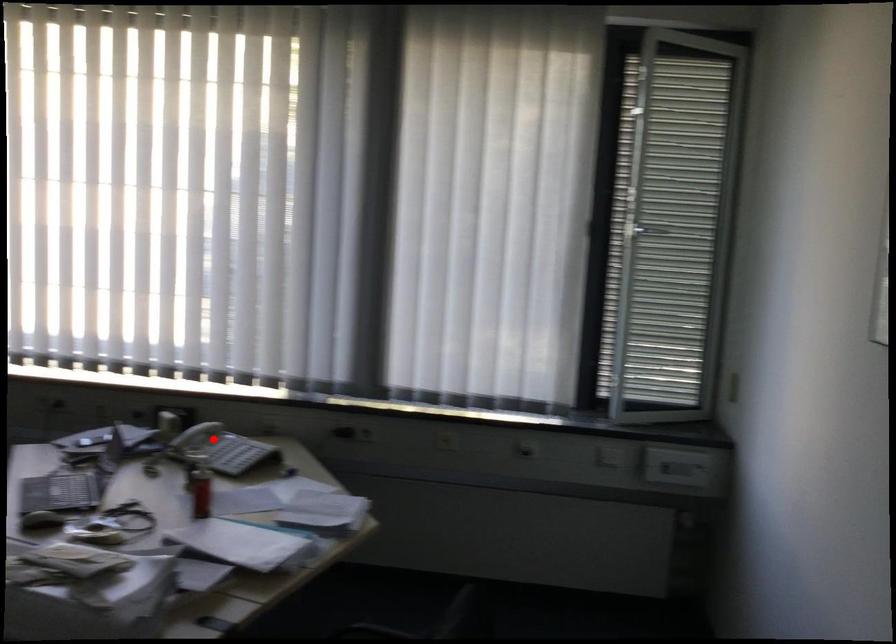
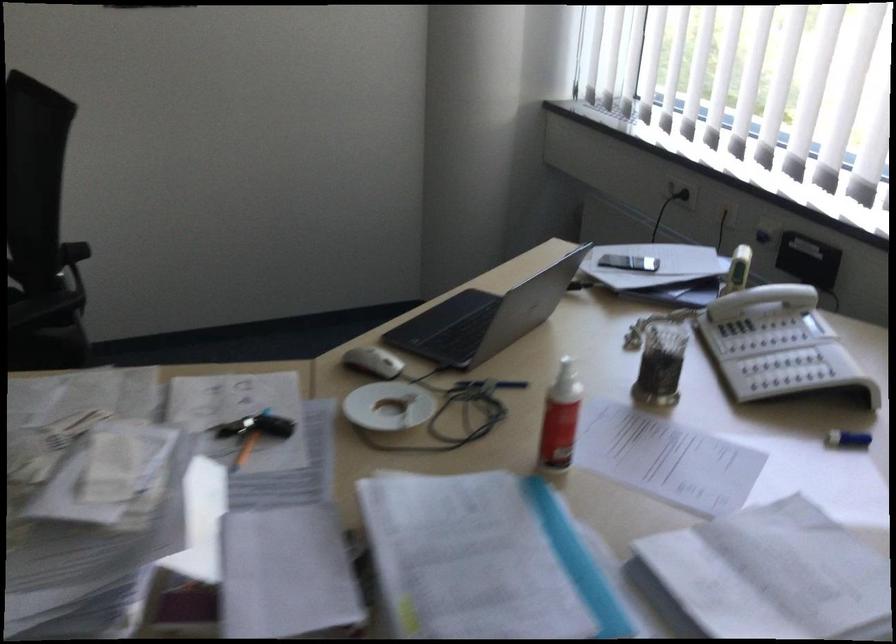
Locate, in the second image, the point that corresponds to the highlighted location in the first image.

(757, 321)